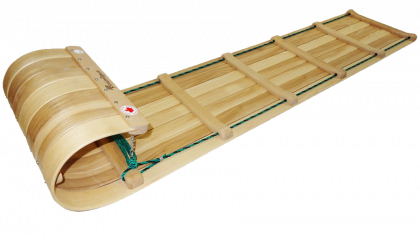
You are a GUI agent. You are given a task and a screenshot of the screen. Output one action in this format:
    pyautogui.click(x=<x>, y=<y>)
    Task: Click on the light wood
    
    Given the screenshot: What is the action you would take?
    pyautogui.click(x=181, y=158), pyautogui.click(x=178, y=129), pyautogui.click(x=173, y=111), pyautogui.click(x=164, y=102)